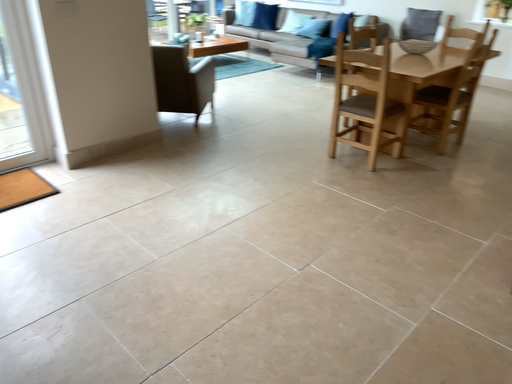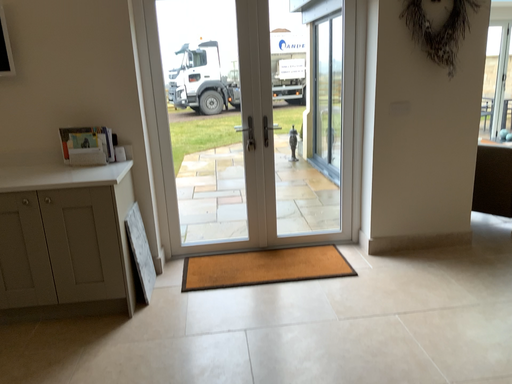
Question: How did the camera likely rotate when shooting the video?

Choices:
 (A) rotated left
 (B) rotated right

Answer: (A)